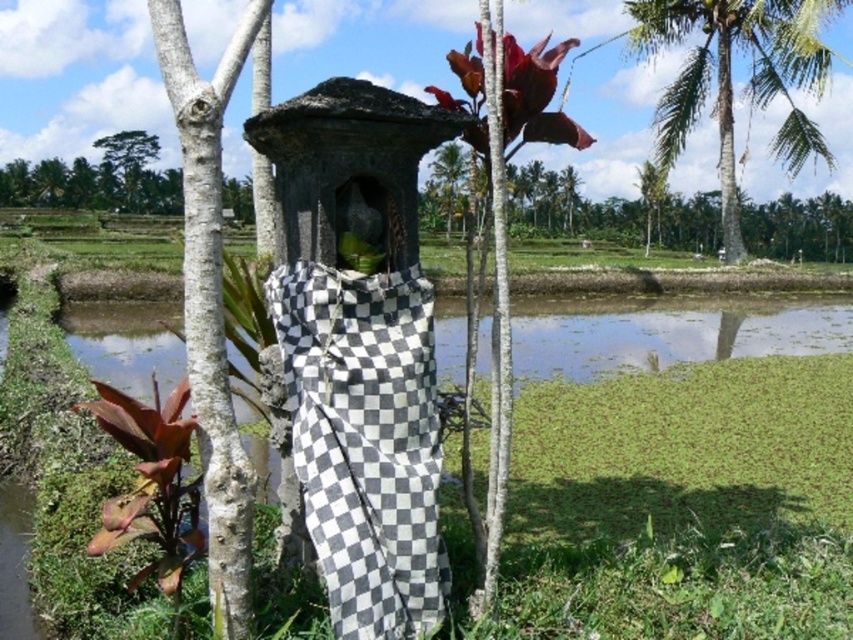
Question: Is black and white checkered cloth at center positioned before green leafy palm at upper right?

Choices:
 (A) yes
 (B) no

Answer: (A)

Question: Is black and white checkered cloth at center bigger than leathery red leaf at upper center?

Choices:
 (A) no
 (B) yes

Answer: (A)

Question: Which point is farther to the camera?

Choices:
 (A) (126, 182)
 (B) (467, 67)
 (C) (413, 486)

Answer: (A)

Question: Considering the relative positions of green leafy palm at upper right and green leafy tree at upper left in the image provided, where is green leafy palm at upper right located with respect to green leafy tree at upper left?

Choices:
 (A) below
 (B) above

Answer: (A)

Question: Based on their relative distances, which object is nearer to the black and white checkered cloth at center?

Choices:
 (A) green leafy palm at upper right
 (B) leathery red leaf at upper center

Answer: (B)

Question: Which of the following is the closest to the observer?

Choices:
 (A) black and white checkered cloth at center
 (B) green leafy tree at upper left

Answer: (A)